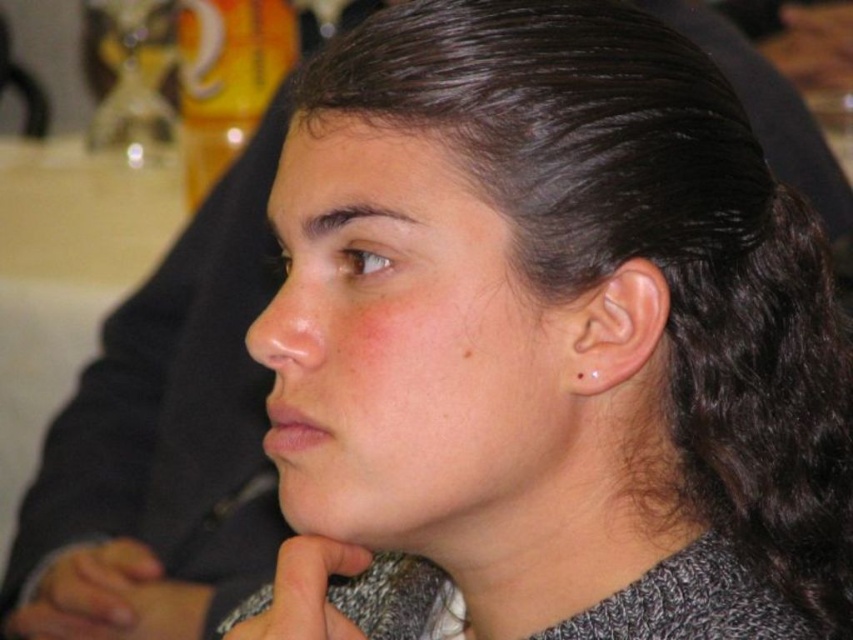
Between gray knitted sweater at lower left and gray knitted sweater at lower center, which one is positioned lower?

gray knitted sweater at lower left is lower down.

This screenshot has width=853, height=640. Find the location of `gray knitted sweater at lower left`. gray knitted sweater at lower left is located at coordinates (91, 595).

This screenshot has height=640, width=853. In order to click on gray knitted sweater at lower left in this screenshot , I will do `click(91, 595)`.